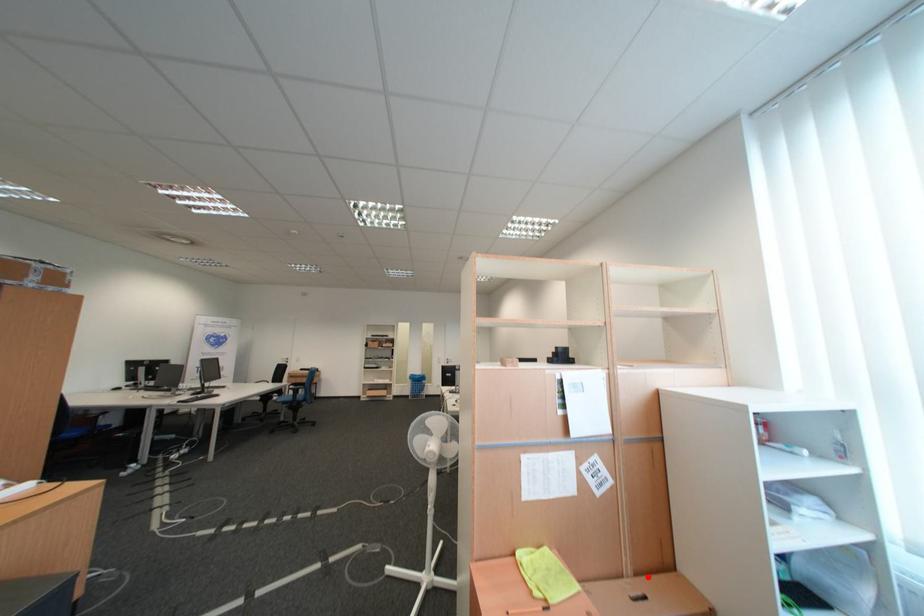
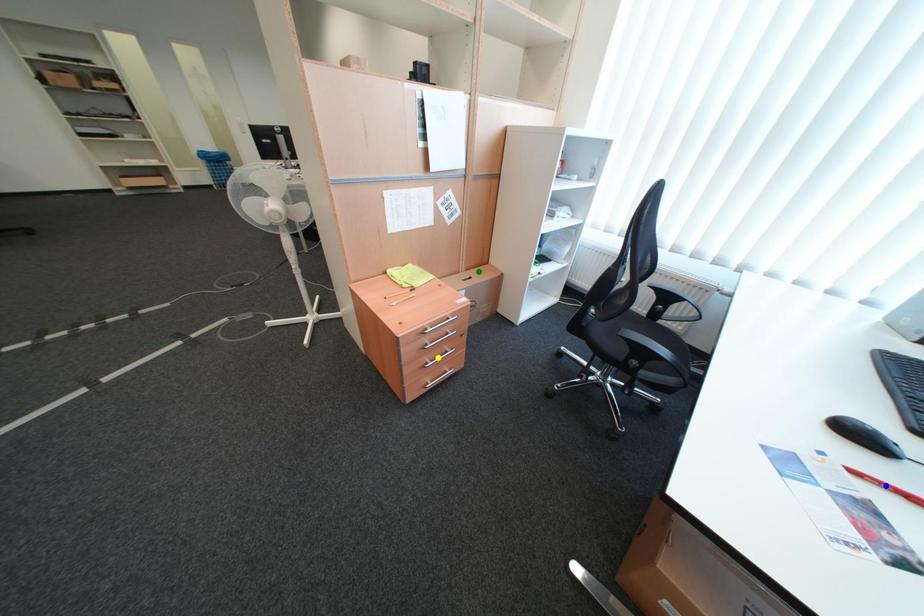
Question: I am providing you with two images of the same scene from different viewpoints. A red point is marked on the first image. You are given multiple points on the second image. Which point in image 2 represents the same 3d spot as the red point in image 1?

Choices:
 (A) blue point
 (B) yellow point
 (C) green point

Answer: (C)